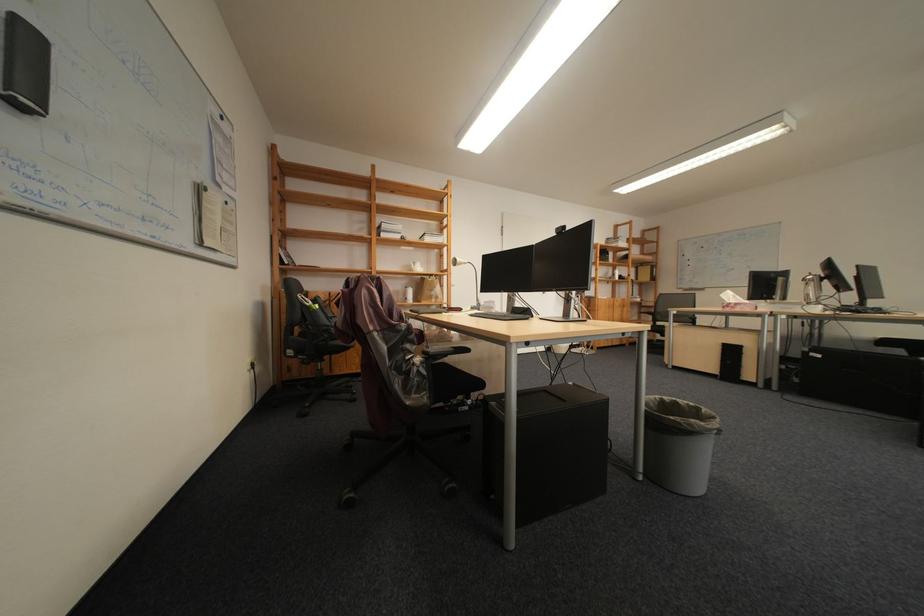
What do you see at coordinates (736, 302) in the screenshot? Image resolution: width=924 pixels, height=616 pixels. I see `the white tissue box` at bounding box center [736, 302].